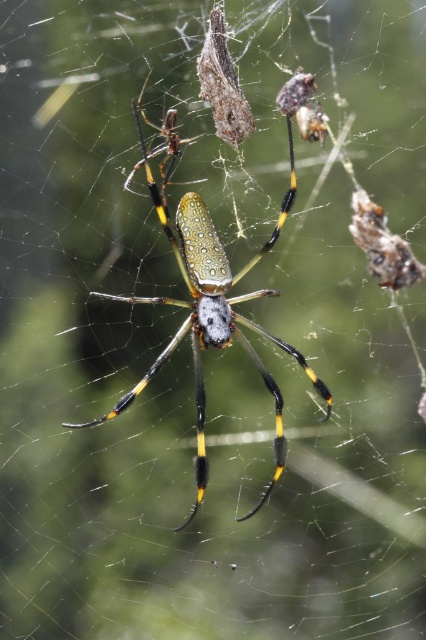
Question: Which point is farther to the camera?

Choices:
 (A) shiny metallic spider at center
 (B) translucent brown cocoon at upper center

Answer: (B)

Question: Does shiny metallic spider at center appear on the right side of translucent brown cocoon at upper center?

Choices:
 (A) yes
 (B) no

Answer: (B)

Question: Among these points, which one is farthest from the camera?

Choices:
 (A) (215, 12)
 (B) (198, 211)

Answer: (B)

Question: Can you confirm if shiny metallic spider at center is positioned above translucent brown cocoon at upper center?

Choices:
 (A) yes
 (B) no

Answer: (B)

Question: Does shiny metallic spider at center come behind translucent brown cocoon at upper center?

Choices:
 (A) no
 (B) yes

Answer: (A)